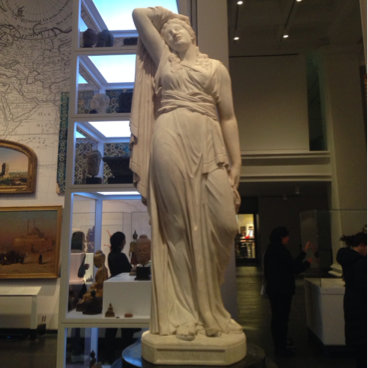
Locate an element on the screen. The image size is (368, 368). light is located at coordinates (122, 193).